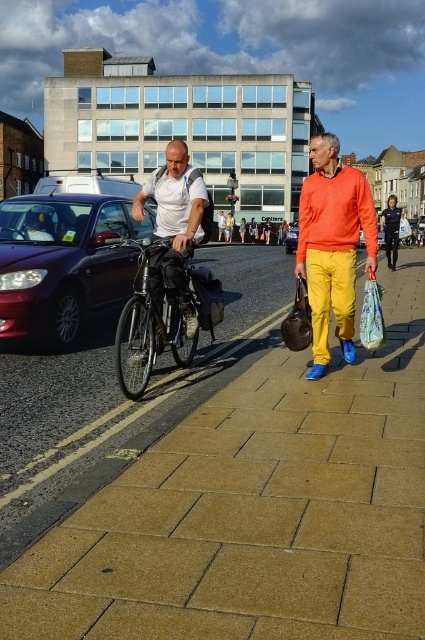
You are a delivery person who needs to place both the printed fabric shopping bag at right and the matte black backpack at center into a storage locker. The locker has a maximum capacity of 10 liters. If the backpack takes up 8 liters, will both items fit?

The printed fabric shopping bag at right occupies less space than the matte black backpack at center. Since the backpack takes up 8 liters, the shopping bag would take up less than 8 liters. However, adding both would exceed the locker capacity of 10 liters. Therefore, both items cannot fit together.

You are standing on the sidewalk and want to walk to the point labeled as point (96, 244). However, there is an obstacle at point (169, 188). Based on their positions, will you be able to reach your destination without going around the obstacle?

Since point (96, 244) is behind point (169, 188), you will have to go around the obstacle at point (169, 188) to reach your destination.